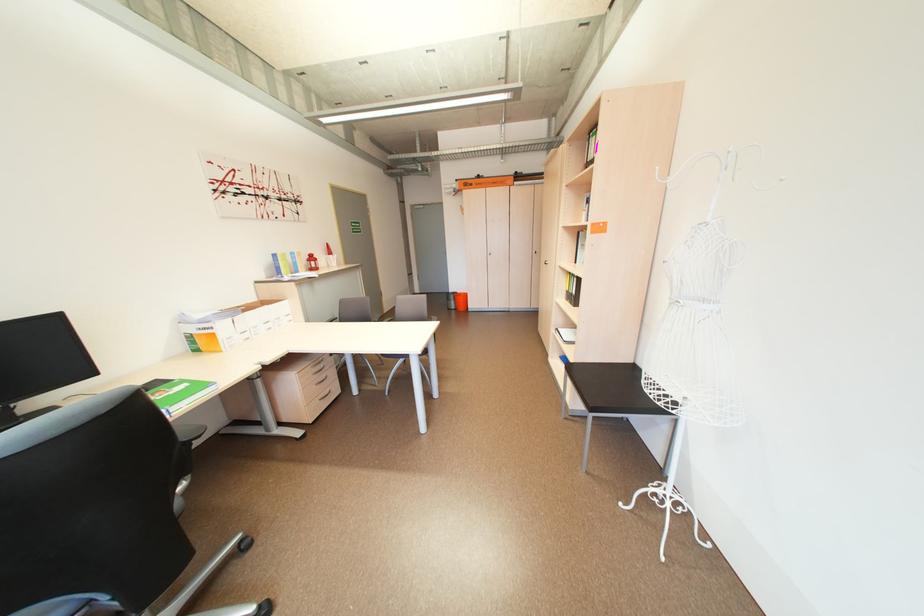
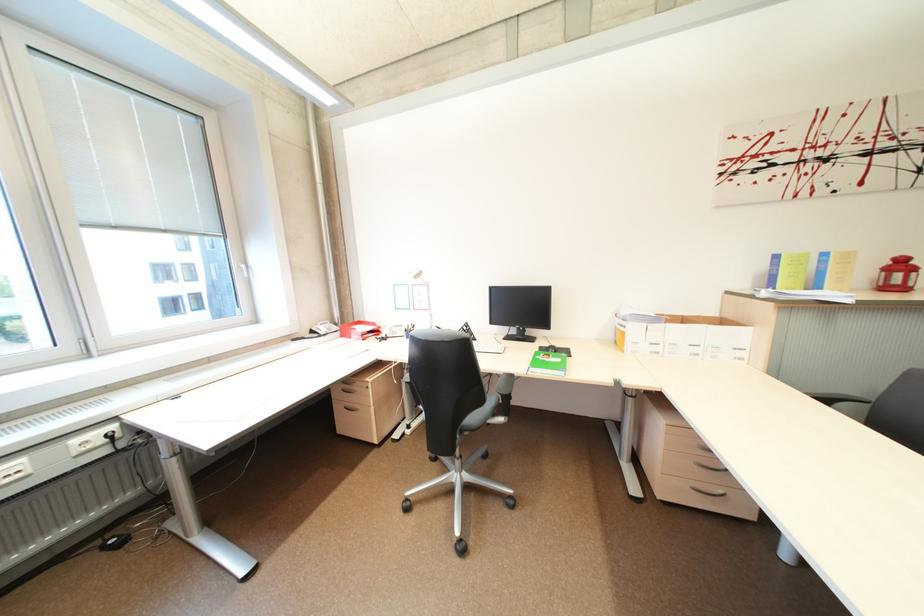
Find the pixel in the second image that matches (284,256) in the first image.

(785, 257)